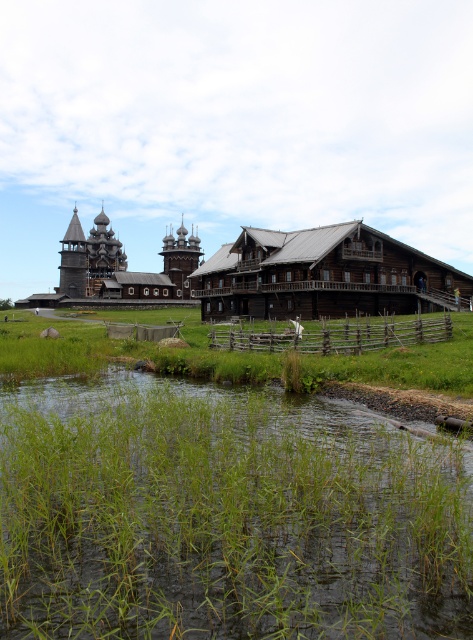
You are standing at the edge of the water in the scene. You want to step onto the green grass at lower center. Based on its 2D coordinates, is it to your left or right?

The green grass at lower center is located at coordinates [225,516]. Since the x coordinate is 0.808, which is closer to the right side of the image, it is to your right.

You are an environmental scientist assessing the vegetation in the area. You need to determine which area has more space to accommodate new plants. Based on the scene, which object has a larger size between the green grass at lower center and the brown wooden fence at center?

The green grass at lower center has a larger size compared to the brown wooden fence at center, so it has more space to accommodate new plants.

You are standing in the scene and want to walk towards the brown wooden fence at center. Which direction should you move relative to the green grass at lower center?

To reach the brown wooden fence at center from the green grass at lower center, you should move away from the green grass at lower center since it is closer to you than the brown wooden fence at center.